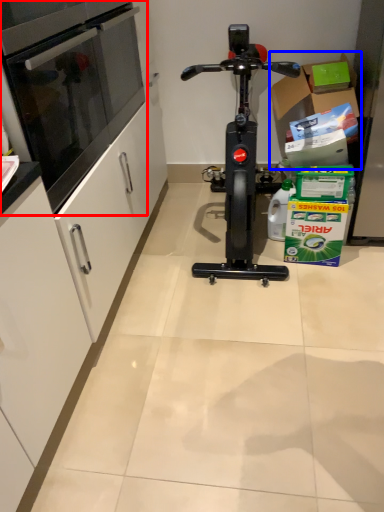
Question: Which point is closer to the camera, oven (highlighted by a red box) or cardboard box (highlighted by a blue box)?

Choices:
 (A) oven
 (B) cardboard box

Answer: (A)